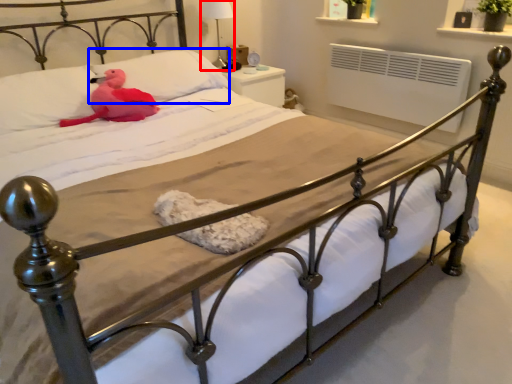
Question: Which point is closer to the camera, table lamp (highlighted by a red box) or pillow (highlighted by a blue box)?

Choices:
 (A) table lamp
 (B) pillow

Answer: (B)